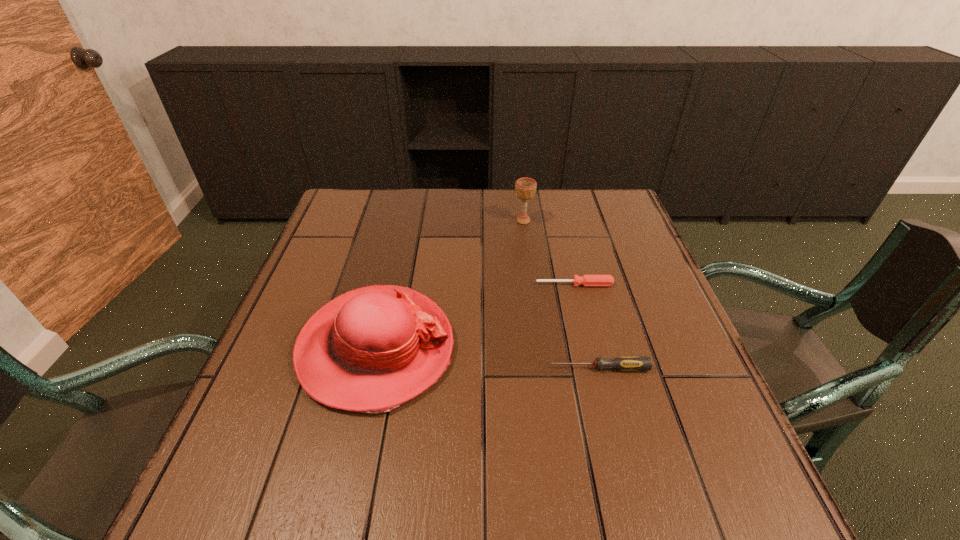
At what (x,y) coordinates should I click in order to perform the action: click on free point between the leftmost object and the nearer screwdriver. Please return your answer as a coordinate pair (x, y). Looking at the image, I should click on (488, 358).

Locate an element on the screen. Image resolution: width=960 pixels, height=540 pixels. vacant area between the nearer screwdriver and the farthest object is located at coordinates (562, 294).

The height and width of the screenshot is (540, 960). I want to click on vacant region between the second farthest object and the leftmost object, so coord(475,316).

Where is `vacant region between the nearer screwdriver and the third nearest object`? The width and height of the screenshot is (960, 540). vacant region between the nearer screwdriver and the third nearest object is located at coordinates (587, 326).

Where is `free point between the farthest object and the nearer screwdriver`? The image size is (960, 540). free point between the farthest object and the nearer screwdriver is located at coordinates (562, 294).

The height and width of the screenshot is (540, 960). I want to click on free area in between the nearer screwdriver and the second farthest object, so click(x=587, y=326).

At what (x,y) coordinates should I click in order to perform the action: click on empty space that is in between the leftmost object and the farther screwdriver. Please return your answer as a coordinate pair (x, y). This screenshot has width=960, height=540. Looking at the image, I should click on (475, 316).

You are a GUI agent. You are given a task and a screenshot of the screen. Output one action in this format:
    pyautogui.click(x=<x>, y=<y>)
    Task: Click on the free space between the farther screwdriver and the hat
    
    Given the screenshot: What is the action you would take?
    pyautogui.click(x=475, y=316)

This screenshot has height=540, width=960. Find the location of `the closest object to the nearer screwdriver`. the closest object to the nearer screwdriver is located at coordinates (372, 349).

You are a GUI agent. You are given a task and a screenshot of the screen. Output one action in this format:
    pyautogui.click(x=<x>, y=<y>)
    Task: Click on the third closest object to the second farthest object
    
    Given the screenshot: What is the action you would take?
    pyautogui.click(x=525, y=188)